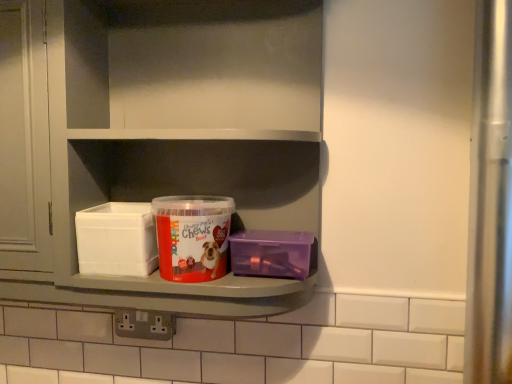
What is the approximate width of red matte plastic container at center?

red matte plastic container at center is 5.46 inches wide.

Locate an element on the screen. purple plastic container at right is located at coordinates (273, 253).

This screenshot has width=512, height=384. What do you see at coordinates (273, 253) in the screenshot?
I see `purple plastic container at right` at bounding box center [273, 253].

Locate an element on the screen. The width and height of the screenshot is (512, 384). white plastic shelf at center is located at coordinates (173, 136).

Looking at the image, does purple plastic container at right seem bigger or smaller compared to red matte plastic container at center?

Considering their sizes, purple plastic container at right takes up less space than red matte plastic container at center.

From a real-world perspective, is purple plastic container at right above or below red matte plastic container at center?

In terms of real-world spatial position, purple plastic container at right is below red matte plastic container at center.

Who is taller, purple plastic container at right or red matte plastic container at center?

Standing taller between the two is red matte plastic container at center.

Which of these two, purple plastic container at right or red matte plastic container at center, is thinner?

purple plastic container at right is thinner.

Can you confirm if white plastic shelf at center is smaller than red matte plastic container at center?

Incorrect, white plastic shelf at center is not smaller in size than red matte plastic container at center.

Is white plastic shelf at center to the right of red matte plastic container at center from the viewer's perspective?

Correct, you'll find white plastic shelf at center to the right of red matte plastic container at center.

Is white plastic shelf at center far from red matte plastic container at center?

No.

How many degrees apart are the facing directions of white plastic shelf at center and red matte plastic container at center?

The angle between the facing direction of white plastic shelf at center and the facing direction of red matte plastic container at center is 0.284 degrees.

Image resolution: width=512 pixels, height=384 pixels. In order to click on shelf located above the purple plastic container at right (from the image's perspective) in this screenshot , I will do `click(173, 136)`.

Does purple plastic container at right have a lesser height compared to white plastic shelf at center?

Yes, purple plastic container at right is shorter than white plastic shelf at center.

Which object is closer to the camera taking this photo, purple plastic container at right or white plastic shelf at center?

white plastic shelf at center.

Is purple plastic container at right facing away from white plastic shelf at center?

Absolutely, purple plastic container at right is directed away from white plastic shelf at center.

Which is correct: white plastic shelf at center is inside purple plastic container at right, or outside of it?

white plastic shelf at center exists outside the volume of purple plastic container at right.

From the image's perspective, who appears lower, white plastic shelf at center or purple plastic container at right?

From the image's view, purple plastic container at right is below.

Is white plastic shelf at center oriented away from purple plastic container at right?

Yes.

Does point (1, 280) come behind point (273, 238)?

That is True.

Considering the relative positions of red matte plastic container at center and white plastic shelf at center in the image provided, is red matte plastic container at center to the right of white plastic shelf at center from the viewer's perspective?

In fact, red matte plastic container at center is to the left of white plastic shelf at center.

Would you say red matte plastic container at center contains white plastic shelf at center?

No, white plastic shelf at center is not inside red matte plastic container at center.

From the image's perspective, who appears lower, red matte plastic container at center or white plastic shelf at center?

red matte plastic container at center appears lower in the image.

Considering the positions of points (205, 261) and (112, 286), is point (205, 261) closer to camera compared to point (112, 286)?

Yes, point (205, 261) is in front of point (112, 286).

Considering the positions of objects red matte plastic container at center and purple plastic container at right in the image provided, who is in front, red matte plastic container at center or purple plastic container at right?

red matte plastic container at center is more forward.

Does red matte plastic container at center have a greater height compared to purple plastic container at right?

Yes, red matte plastic container at center is taller than purple plastic container at right.

Which is more distant, [205,232] or [279,273]?

The point [279,273] is more distant.

How different are the orientations of red matte plastic container at center and purple plastic container at right in degrees?

The angle between the facing direction of red matte plastic container at center and the facing direction of purple plastic container at right is 0.00492 degrees.

Image resolution: width=512 pixels, height=384 pixels. What are the coordinates of `product above the purple plastic container at right (from a real-world perspective)` in the screenshot? It's located at (192, 236).

Locate an element on the screen. The image size is (512, 384). product located on the left of white plastic shelf at center is located at coordinates (192, 236).

From the picture: Considering their positions, is white plastic shelf at center positioned further to purple plastic container at right than red matte plastic container at center?

The object further to purple plastic container at right is white plastic shelf at center.

Considering their positions, is white plastic shelf at center positioned closer to red matte plastic container at center than purple plastic container at right?

The object closer to red matte plastic container at center is purple plastic container at right.

Looking at the image, which one is located closer to purple plastic container at right, red matte plastic container at center or white plastic shelf at center?

The object closer to purple plastic container at right is red matte plastic container at center.

From the image, which object appears to be nearer to red matte plastic container at center, purple plastic container at right or white plastic shelf at center?

Among the two, purple plastic container at right is located nearer to red matte plastic container at center.

From the image, which object appears to be nearer to white plastic shelf at center, red matte plastic container at center or purple plastic container at right?

red matte plastic container at center.

From the image, which object appears to be farther from white plastic shelf at center, purple plastic container at right or red matte plastic container at center?

Among the two, purple plastic container at right is located further to white plastic shelf at center.

Identify the location of product between white plastic shelf at center and purple plastic container at right vertically. The width and height of the screenshot is (512, 384). (192, 236).